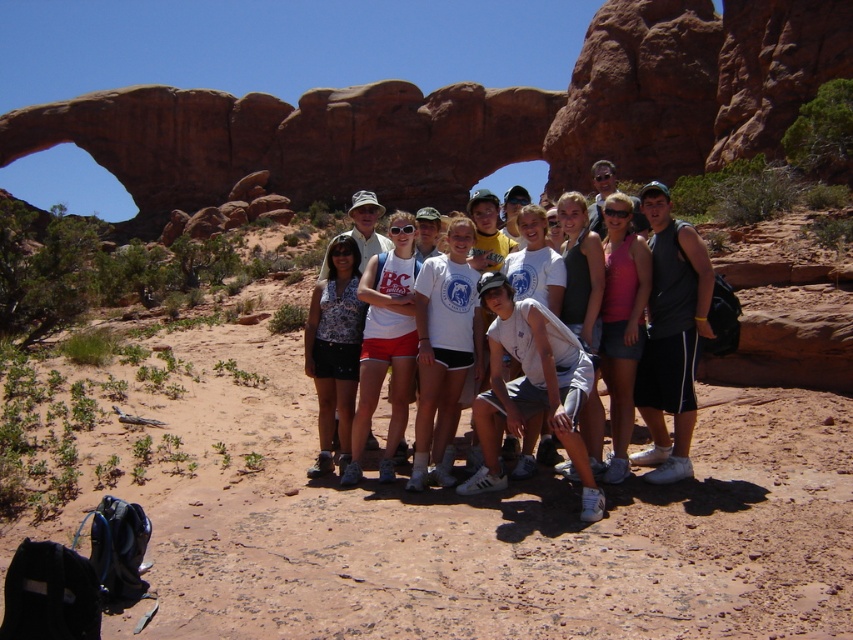
Which is more to the left, white cotton tank top at center or pink fabric tank top at center?

white cotton tank top at center

Is white cotton tank top at center wider than pink fabric tank top at center?

Correct, the width of white cotton tank top at center exceeds that of pink fabric tank top at center.

Does point (389, 360) come behind point (630, 259)?

No, (389, 360) is closer to viewer.

Locate an element on the screen. This screenshot has width=853, height=640. white cotton tank top at center is located at coordinates (386, 344).

Is white cotton t-shirt at center positioned behind white cotton tank top at center?

No, it is in front of white cotton tank top at center.

Based on the photo, who is more forward, (509, 388) or (387, 451)?

Point (509, 388)

The image size is (853, 640). Identify the location of white cotton t-shirt at center. (523, 387).

Can you confirm if pink fabric tank top at center is bigger than matte gray tank top at center?

No.

Who is lower down, pink fabric tank top at center or matte gray tank top at center?

pink fabric tank top at center

Does point (625, 342) come farther from viewer compared to point (575, 244)?

No, it is in front of (575, 244).

You are a GUI agent. You are given a task and a screenshot of the screen. Output one action in this format:
    pyautogui.click(x=<x>, y=<y>)
    Task: Click on the pink fabric tank top at center
    
    Given the screenshot: What is the action you would take?
    pyautogui.click(x=621, y=323)